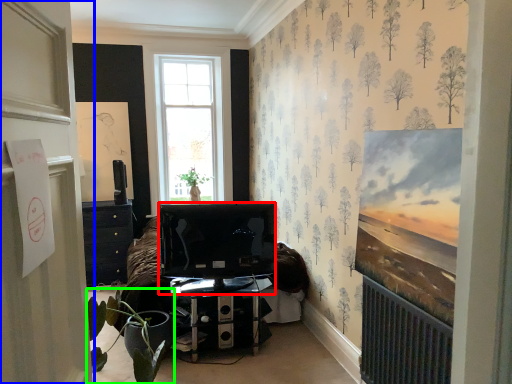
Question: Considering the real-world distances, which object is farthest from television (highlighted by a red box)? door (highlighted by a blue box) or houseplant (highlighted by a green box)?

Choices:
 (A) door
 (B) houseplant

Answer: (A)